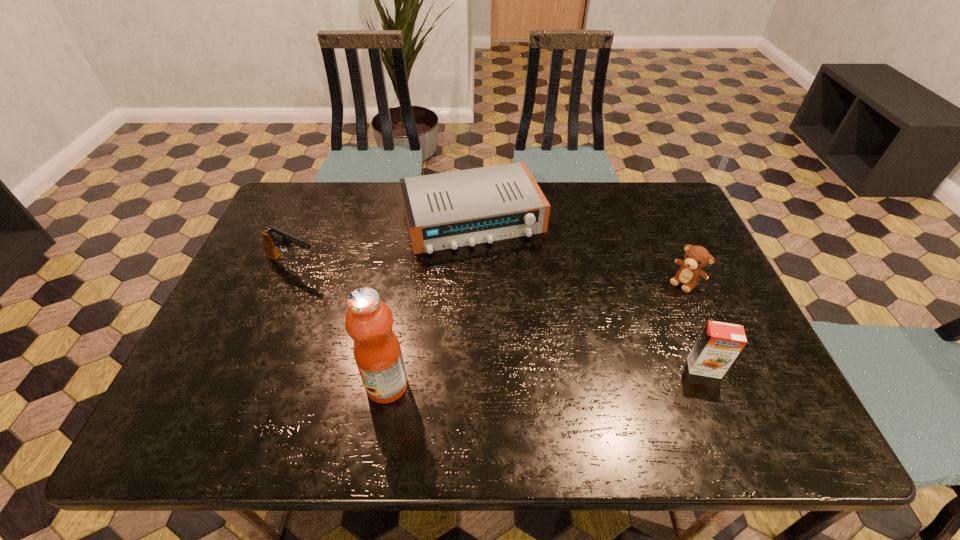
Identify the location of free location located on the face of the teddy bear. The height and width of the screenshot is (540, 960). (613, 352).

Locate an element on the screen. This screenshot has height=540, width=960. free space located on the face of the teddy bear is located at coordinates (658, 308).

In order to click on vacant space located 0.070m on the control panel of the shortest object in this screenshot , I will do `click(498, 273)`.

Locate an element on the screen. free region located 0.190m on the control panel of the shortest object is located at coordinates (512, 306).

This screenshot has width=960, height=540. What are the coordinates of `vacant space situated 0.110m on the control panel of the shortest object` in the screenshot? It's located at (502, 284).

Locate an element on the screen. The height and width of the screenshot is (540, 960). vacant space located along the barrel of the leftmost object is located at coordinates (390, 306).

Find the location of a particular element. vacant space located along the barrel of the leftmost object is located at coordinates (433, 327).

Where is `vacant space located along the barrel of the leftmost object`? The width and height of the screenshot is (960, 540). vacant space located along the barrel of the leftmost object is located at coordinates (381, 301).

The width and height of the screenshot is (960, 540). In order to click on object situated at the far edge in this screenshot , I will do `click(446, 210)`.

Find the location of a particular element. The width and height of the screenshot is (960, 540). fruit juice located in the near edge section of the desktop is located at coordinates (369, 321).